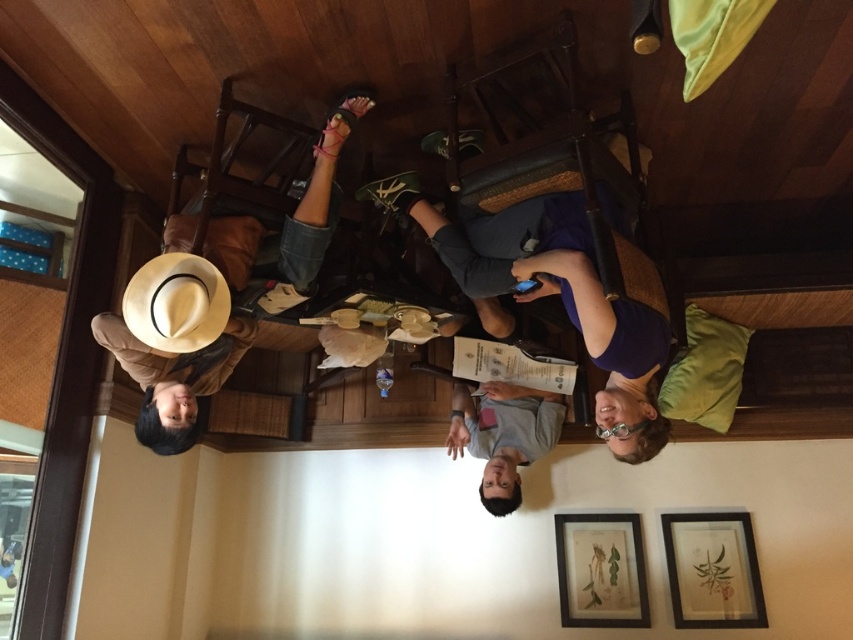
Question: Is light brown straw hat at lower left to the left of white felt cowboy hat at upper left from the viewer's perspective?

Choices:
 (A) yes
 (B) no

Answer: (A)

Question: Among these objects, which one is farthest from the camera?

Choices:
 (A) light brown straw hat at lower left
 (B) white felt cowboy hat at upper left

Answer: (A)

Question: Among these points, which one is nearest to the camera?

Choices:
 (A) (641, 305)
 (B) (219, 296)
 (C) (96, 332)

Answer: (A)

Question: Can you confirm if purple fabric at center is positioned to the right of light brown straw hat at lower left?

Choices:
 (A) yes
 (B) no

Answer: (A)

Question: Which object is closer to the camera taking this photo?

Choices:
 (A) white felt cowboy hat at upper left
 (B) light brown straw hat at lower left
 (C) purple fabric at center

Answer: (C)

Question: Is purple fabric at center smaller than white felt cowboy hat at upper left?

Choices:
 (A) no
 (B) yes

Answer: (A)